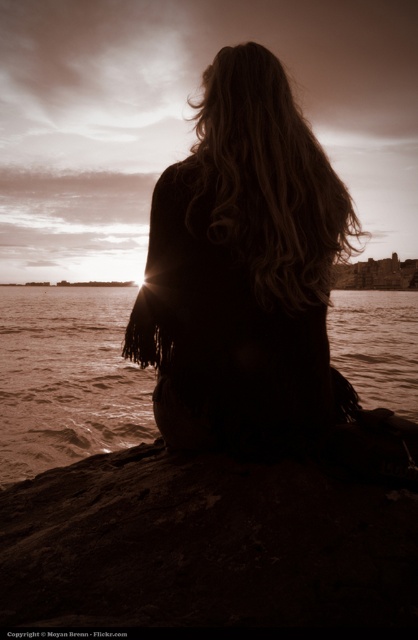
Can you confirm if dark brown hair at center is thinner than brown water at center?

Indeed, dark brown hair at center has a lesser width compared to brown water at center.

The height and width of the screenshot is (640, 418). Identify the location of dark brown hair at center. (244, 272).

Where is `dark brown hair at center`? Image resolution: width=418 pixels, height=640 pixels. dark brown hair at center is located at coordinates (244, 272).